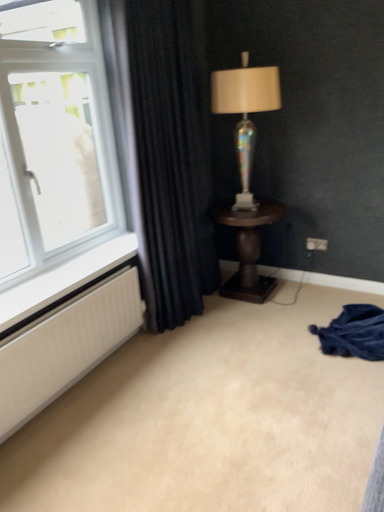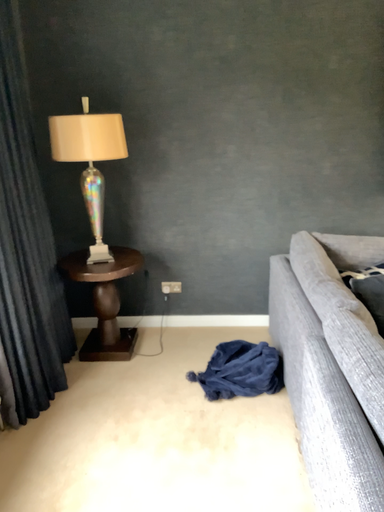
Question: Which way did the camera rotate in the video?

Choices:
 (A) rotated upward
 (B) rotated downward

Answer: (A)